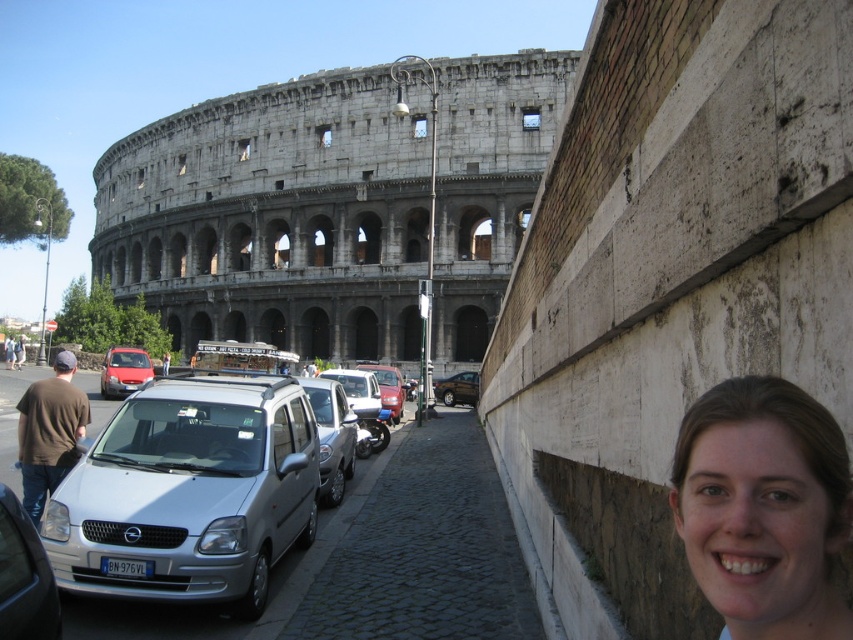
Is gray stone amphitheater at upper left thinner than smooth skin face at lower right?

No.

Can you confirm if gray stone amphitheater at upper left is smaller than smooth skin face at lower right?

No.

Which is behind, point (225, 280) or point (714, 394)?

Positioned behind is point (225, 280).

I want to click on gray stone amphitheater at upper left, so [x=276, y=216].

Is gray stone amphitheater at upper left bigger than silver metallic car at lower left?

Yes.

Is point (456, 172) less distant than point (38, 557)?

That is False.

Locate an element on the screen. gray stone amphitheater at upper left is located at coordinates (276, 216).

In order to click on gray stone amphitheater at upper left in this screenshot , I will do `click(276, 216)`.

Is silver metallic van at center wider than brown cotton shirt at left?

In fact, silver metallic van at center might be narrower than brown cotton shirt at left.

Looking at this image, can you confirm if silver metallic van at center is positioned below brown cotton shirt at left?

Correct, silver metallic van at center is located below brown cotton shirt at left.

Identify the location of silver metallic van at center. This screenshot has height=640, width=853. (189, 493).